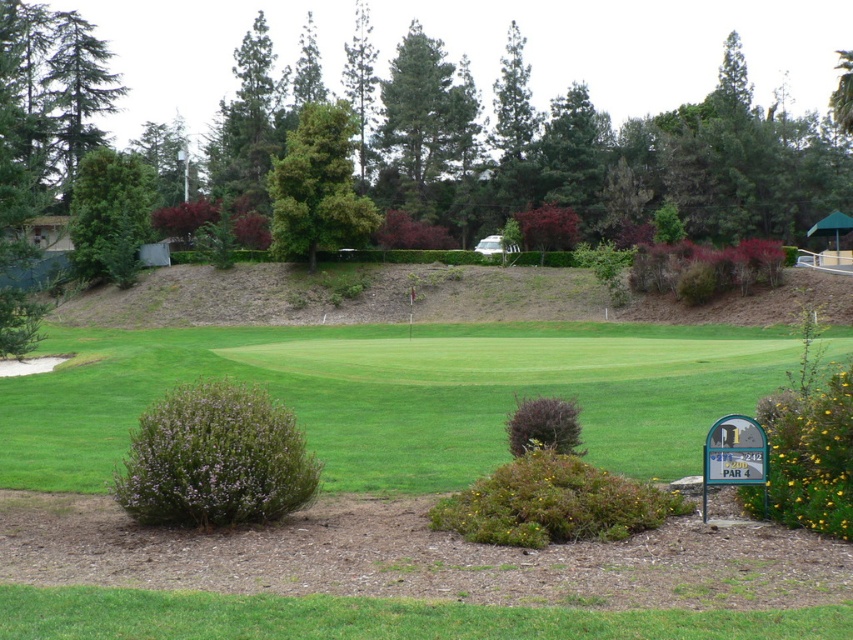
Does green grassy field at center have a smaller size compared to green textured tree at upper center?

Yes.

Does green grassy field at center have a larger size compared to green textured tree at upper center?

No, green grassy field at center is not bigger than green textured tree at upper center.

Find the location of `green grassy field at center`. green grassy field at center is located at coordinates (397, 394).

I want to click on green grassy field at center, so click(x=397, y=394).

Between point (115, 211) and point (57, 74), which one is positioned behind?

The point (57, 74) is behind.

Is green leafy bush at upper left positioned behind green needle-like at upper left?

No, it is in front of green needle-like at upper left.

Is point (74, 232) more distant than point (82, 54)?

No, (74, 232) is in front of (82, 54).

Find the location of a particular element. Image resolution: width=853 pixels, height=640 pixels. green leafy bush at upper left is located at coordinates (109, 214).

Can you confirm if purple leafy bush at center is wider than brown textured bush at center?

Incorrect, purple leafy bush at center's width does not surpass brown textured bush at center's.

Describe the element at coordinates (215, 460) in the screenshot. I see `purple leafy bush at center` at that location.

Does point (198, 497) lie in front of point (613, 484)?

That is True.

Locate an element on the screen. The width and height of the screenshot is (853, 640). purple leafy bush at center is located at coordinates (215, 460).